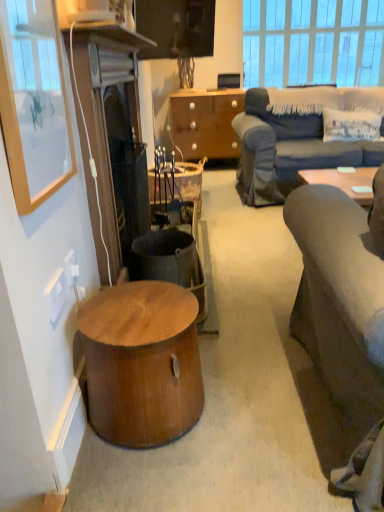
Where is `spots to the right of dark brown wood fireplace at left`? This screenshot has height=512, width=384. spots to the right of dark brown wood fireplace at left is located at coordinates (249, 264).